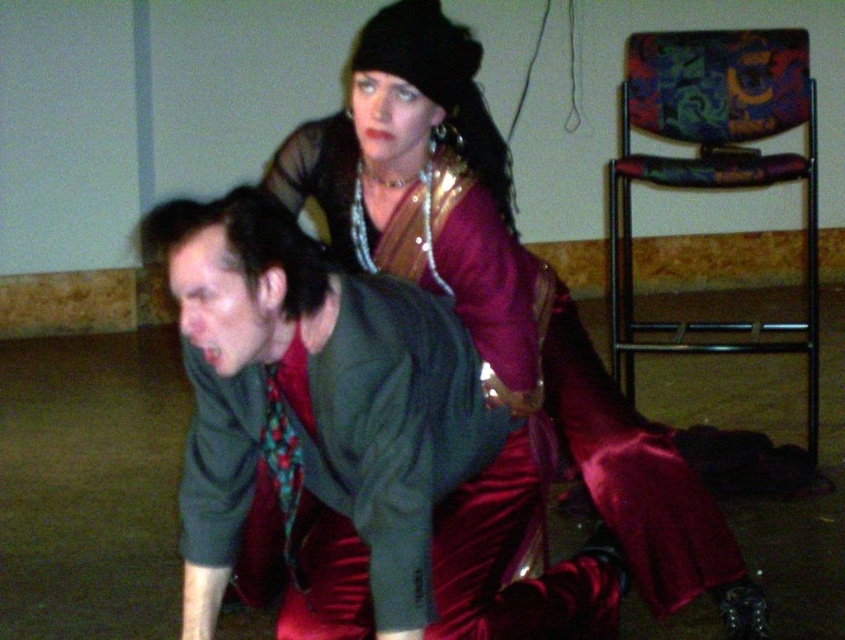
Question: Which of the following is the closest to the observer?

Choices:
 (A) satin burgundy dress at upper center
 (B) green matte shirt at center

Answer: (B)

Question: Can you confirm if satin burgundy dress at upper center is smaller than green matte shirt at center?

Choices:
 (A) no
 (B) yes

Answer: (A)

Question: Considering the relative positions of satin burgundy dress at upper center and green matte shirt at center in the image provided, where is satin burgundy dress at upper center located with respect to green matte shirt at center?

Choices:
 (A) right
 (B) left

Answer: (A)

Question: In this image, where is satin burgundy dress at upper center located relative to green matte shirt at center?

Choices:
 (A) left
 (B) right

Answer: (B)

Question: Among these objects, which one is nearest to the camera?

Choices:
 (A) green matte shirt at center
 (B) satin burgundy dress at upper center

Answer: (A)